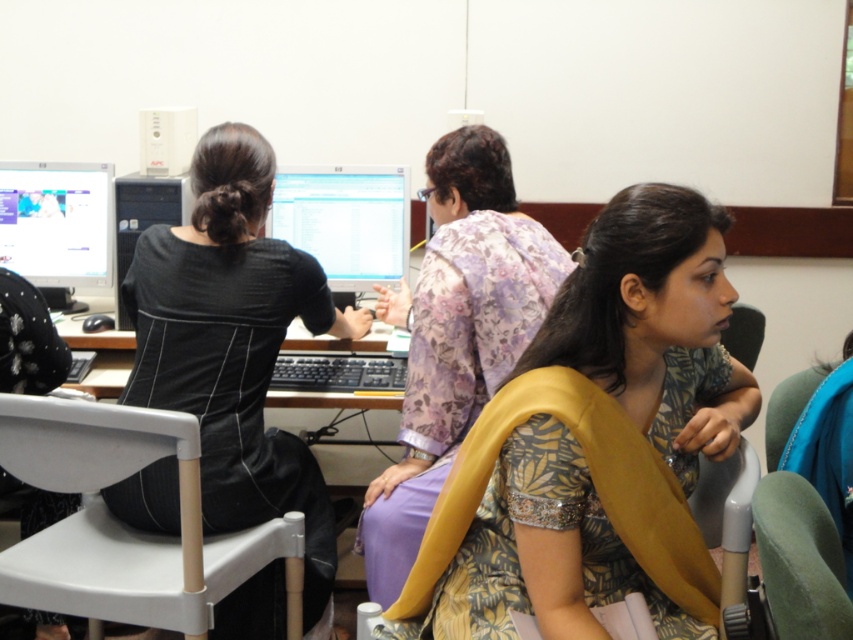
This screenshot has height=640, width=853. What do you see at coordinates (234, 346) in the screenshot?
I see `black matte dress at center` at bounding box center [234, 346].

Does black matte dress at center have a lesser width compared to white plastic chair at lower left?

Yes, black matte dress at center is thinner than white plastic chair at lower left.

Between point (244, 216) and point (6, 577), which one is positioned behind?

The point (244, 216) is more distant.

This screenshot has width=853, height=640. Find the location of `black matte dress at center`. black matte dress at center is located at coordinates click(234, 346).

Which of these two, white plastic chair at lower left or green fabric chair at lower right, stands shorter?

green fabric chair at lower right

Between white plastic chair at lower left and green fabric chair at lower right, which one is positioned higher?

green fabric chair at lower right is above.

Describe the element at coordinates (125, 525) in the screenshot. I see `white plastic chair at lower left` at that location.

You are a GUI agent. You are given a task and a screenshot of the screen. Output one action in this format:
    pyautogui.click(x=<x>, y=<y>)
    Task: Click on the white plastic chair at lower left
    
    Given the screenshot: What is the action you would take?
    pyautogui.click(x=125, y=525)

Where is `white plastic chair at lower left`? The width and height of the screenshot is (853, 640). white plastic chair at lower left is located at coordinates (125, 525).

Based on the photo, does white plastic chair at lower left lie in front of black plastic tower at center?

Yes.

Identify the location of white plastic chair at lower left. The image size is (853, 640). (125, 525).